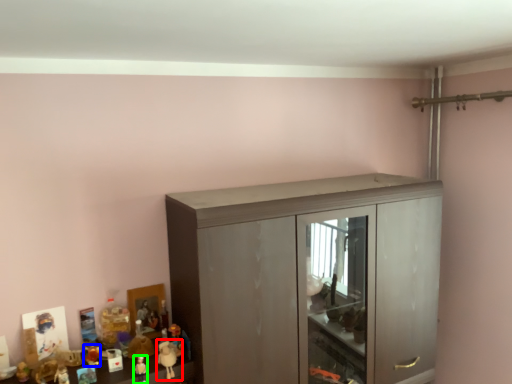
Question: Which is farther away from toy (highlighted by a red box)? toy (highlighted by a blue box) or toy (highlighted by a green box)?

Choices:
 (A) toy
 (B) toy

Answer: (A)